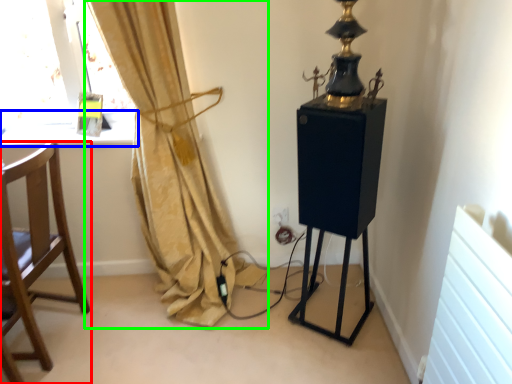
Question: Estimate the real-world distances between objects in this image. Which object is closer to chair (highlighted by a red box), window sill (highlighted by a blue box) or curtain (highlighted by a green box)?

Choices:
 (A) window sill
 (B) curtain

Answer: (B)